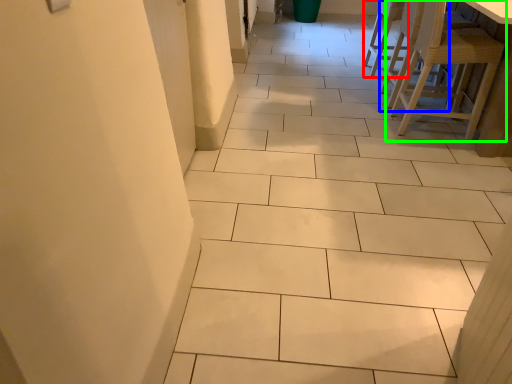
Question: Which object is the closest to the chair (highlighted by a red box)? Choose among these: chair (highlighted by a blue box) or chair (highlighted by a green box).

Choices:
 (A) chair
 (B) chair

Answer: (A)